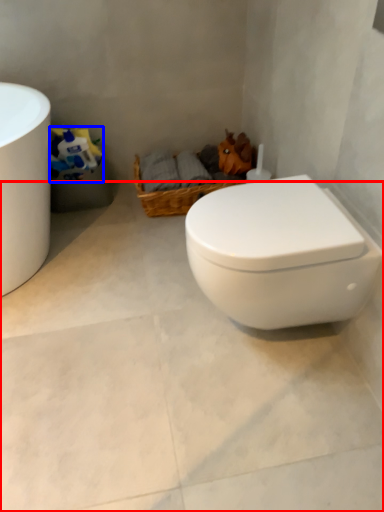
Question: Among these objects, which one is nearest to the camera, concrete (highlighted by a red box) or toilet paper (highlighted by a blue box)?

Choices:
 (A) concrete
 (B) toilet paper

Answer: (A)